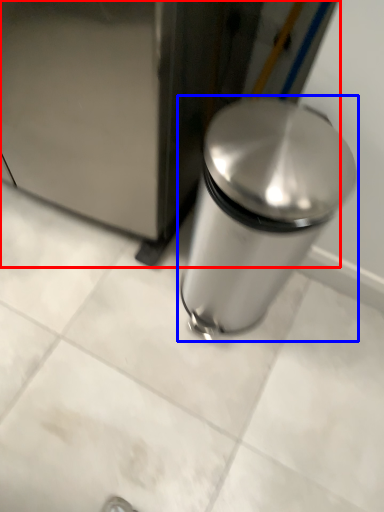
Question: Which object appears closest to the camera in this image, appliance (highlighted by a red box) or waste container (highlighted by a blue box)?

Choices:
 (A) appliance
 (B) waste container

Answer: (A)